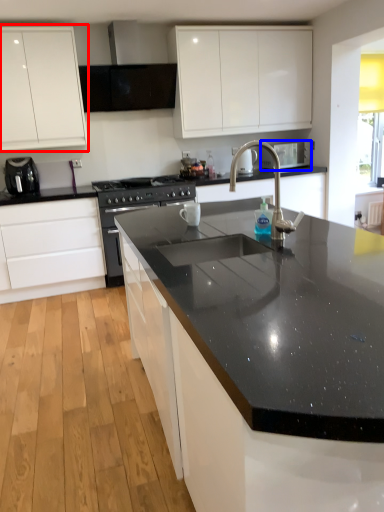
Question: Among these objects, which one is farthest to the camera, cabinetry (highlighted by a red box) or appliance (highlighted by a blue box)?

Choices:
 (A) cabinetry
 (B) appliance

Answer: (B)